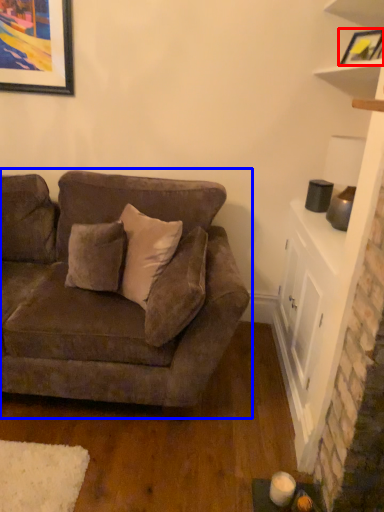
Question: Which object appears farthest to the camera in this image, picture frame (highlighted by a red box) or studio couch (highlighted by a blue box)?

Choices:
 (A) picture frame
 (B) studio couch

Answer: (A)